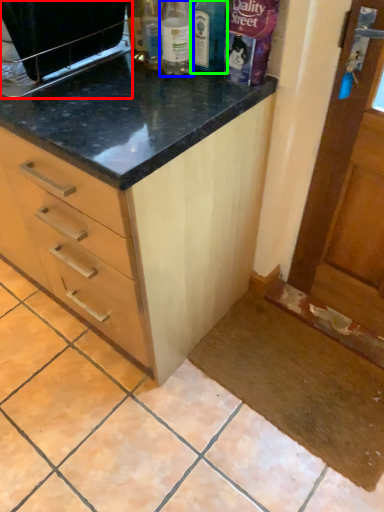
Question: Based on their relative distances, which object is nearer to appliance (highlighted by a red box)? Choose from bottle (highlighted by a blue box) and bottle (highlighted by a green box).

Choices:
 (A) bottle
 (B) bottle

Answer: (A)